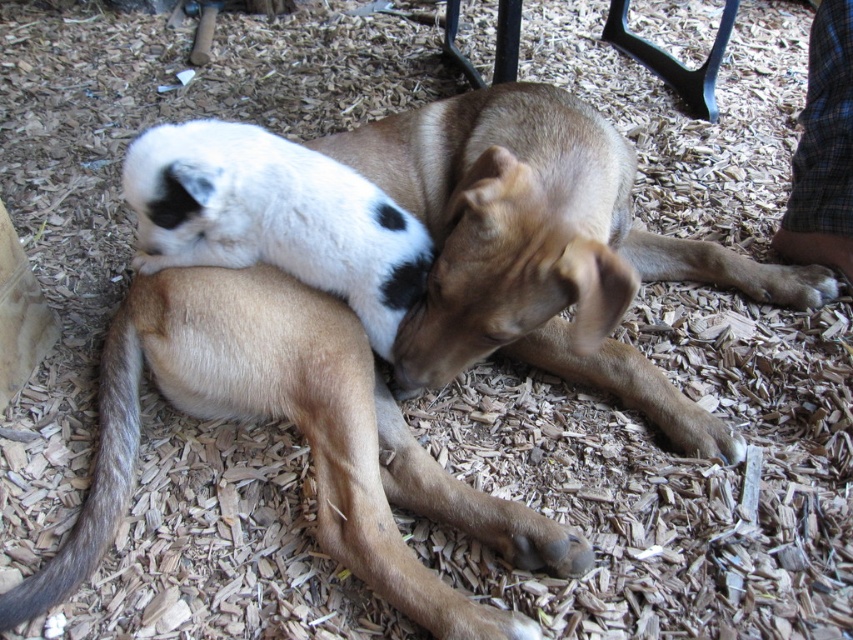
Who is more distant from viewer, (415, 186) or (99, 486)?

The point (415, 186) is more distant.

Is point (524, 241) positioned behind point (123, 378)?

No, (524, 241) is in front of (123, 378).

Measure the distance between point (378,397) and camera.

Point (378,397) and camera are 5.02 feet apart from each other.

Identify the location of light brown fur dog at center. (544, 248).

Between light brown fur dog at center and brown fur dog at center, which one has less height?

Standing shorter between the two is brown fur dog at center.

Where is `light brown fur dog at center`? This screenshot has width=853, height=640. light brown fur dog at center is located at coordinates (544, 248).

Is point (312, 397) in front of point (285, 392)?

Yes.

Where is `light brown fur dog at center`? The height and width of the screenshot is (640, 853). light brown fur dog at center is located at coordinates (544, 248).

Between brown fur dog at center and gray-furred tail at lower left, which one is positioned lower?

Positioned lower is brown fur dog at center.

Is brown fur dog at center thinner than gray-furred tail at lower left?

Incorrect, brown fur dog at center's width is not less than gray-furred tail at lower left's.

Is point (393, 428) positioned before point (126, 332)?

Yes, point (393, 428) is closer to viewer.

Locate an element on the screen. The image size is (853, 640). brown fur dog at center is located at coordinates (300, 432).